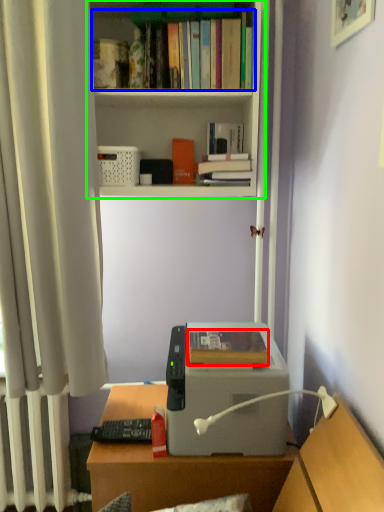
Question: Estimate the real-world distances between objects in this image. Which object is closer to book (highlighted by a red box), book (highlighted by a blue box) or bookcase (highlighted by a green box)?

Choices:
 (A) book
 (B) bookcase

Answer: (B)